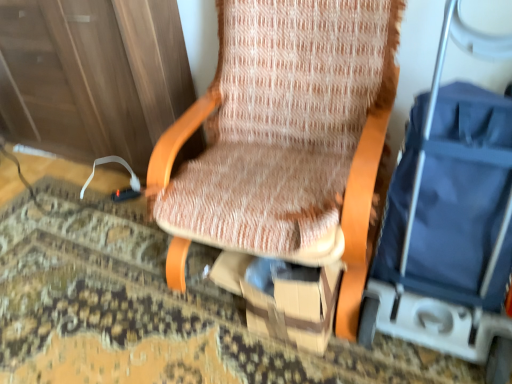
Question: From the image's perspective, is brown cardboard box at center located above or below blue fabric baby carriage at right?

Choices:
 (A) below
 (B) above

Answer: (A)

Question: Choose the correct answer: Is brown cardboard box at center inside blue fabric baby carriage at right or outside it?

Choices:
 (A) inside
 (B) outside

Answer: (B)

Question: Considering the real-world distances, which object is closest to the blue fabric baby carriage at right?

Choices:
 (A) brown cardboard box at center
 (B) textured fabric chair at center

Answer: (A)

Question: Which object is the farthest from the textured fabric chair at center?

Choices:
 (A) blue fabric baby carriage at right
 (B) brown cardboard box at center

Answer: (A)